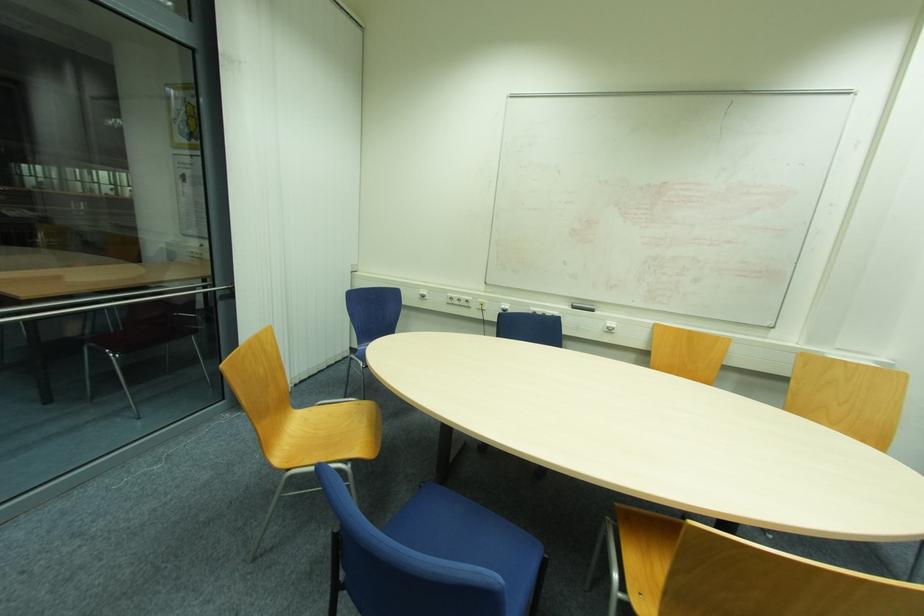
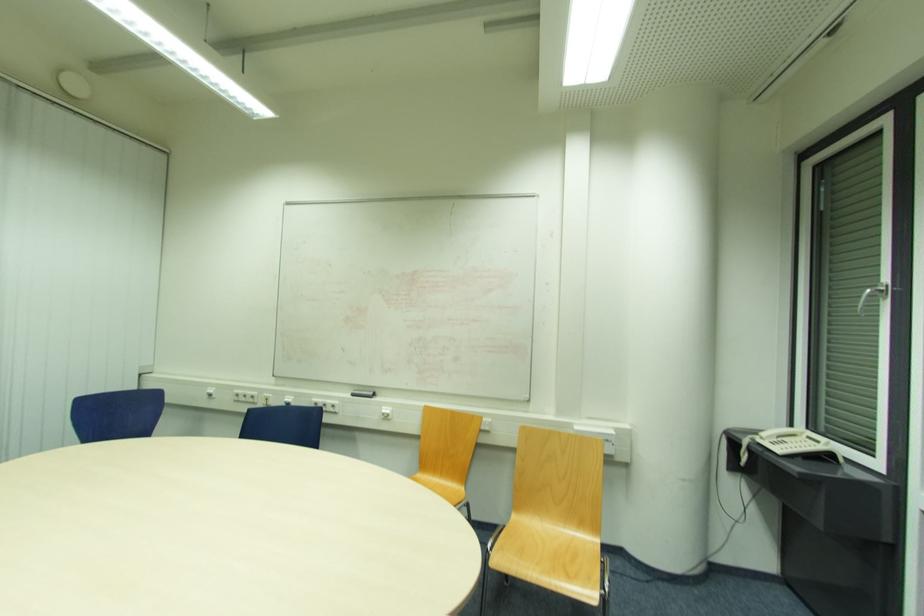
Where in the second image is the point corresponding to the point at 575,309 from the first image?

(355, 395)